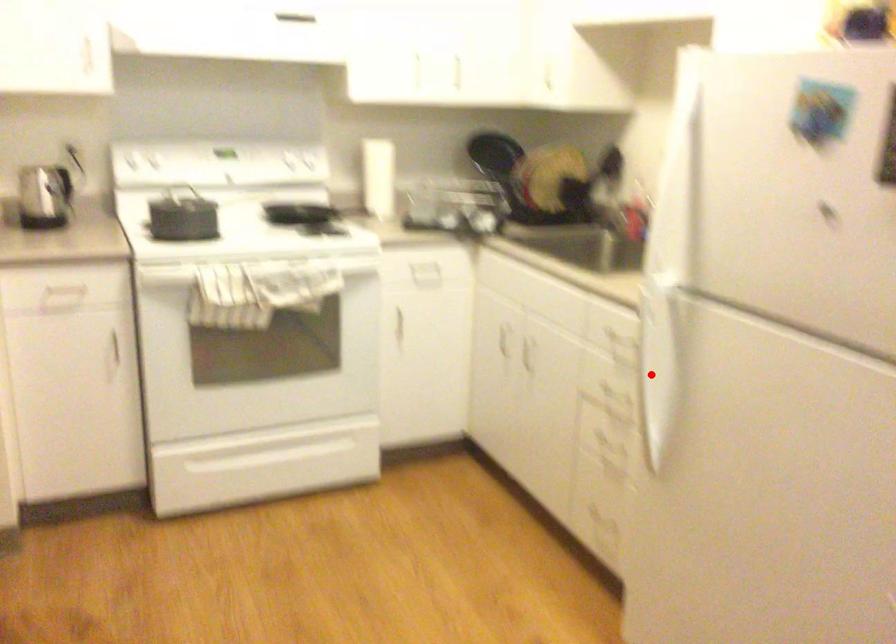
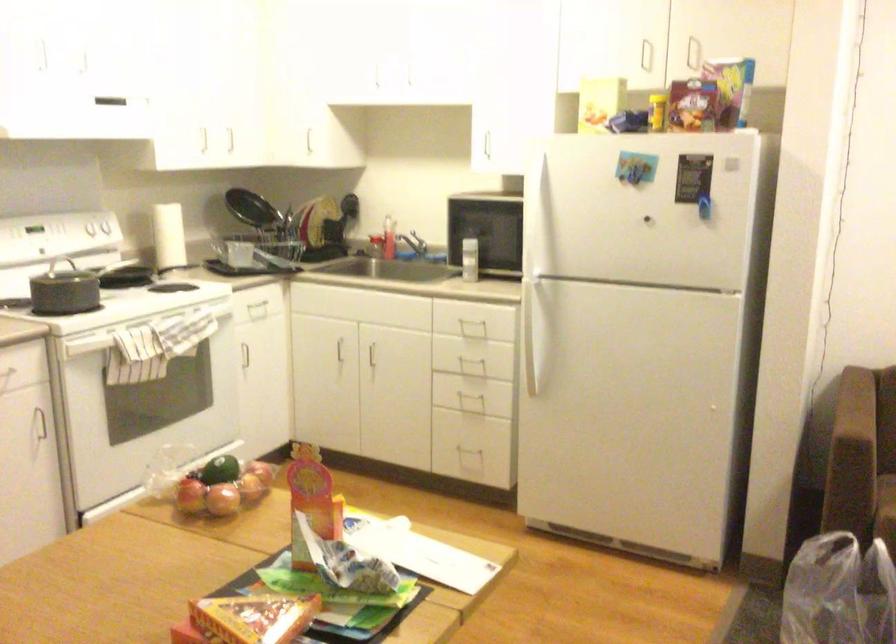
Question: I am providing you with two images of the same scene from different viewpoints. A red point is marked on the first image. Can you still see the location of the red point in image 2?

Choices:
 (A) Yes
 (B) No

Answer: (A)